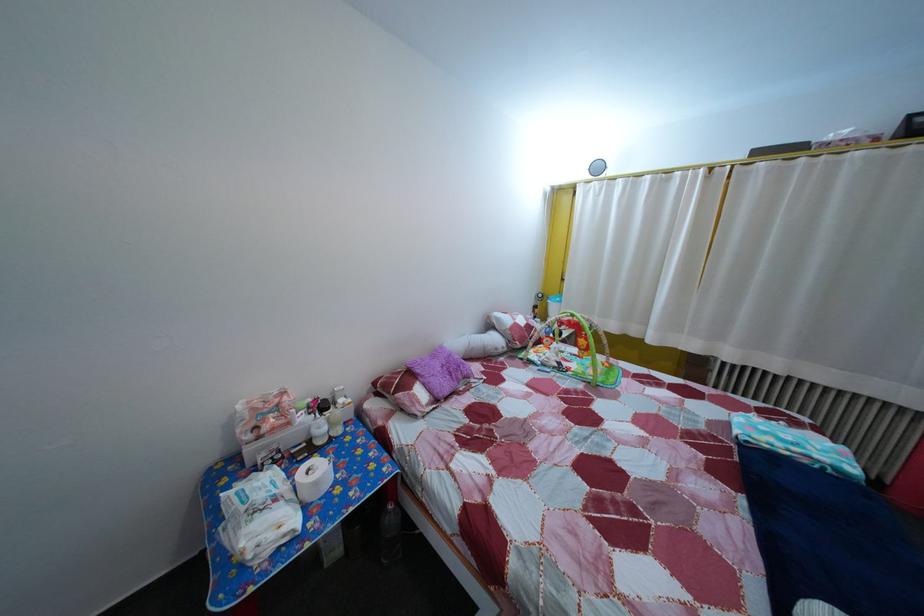
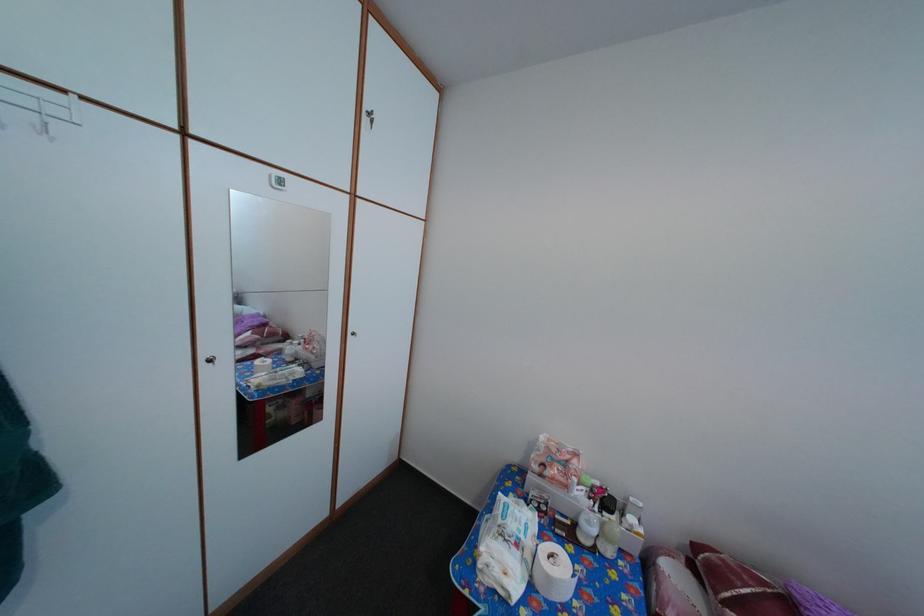
Find the pixel in the second image that matches (251,573) in the first image.

(484, 572)